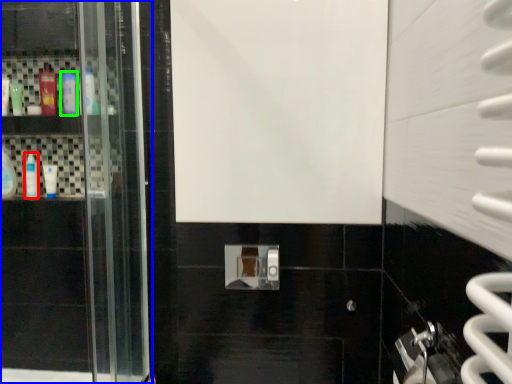
Question: Considering the real-world distances, which object is closest to mouthwash (highlighted by a red box)? door (highlighted by a blue box) or mouthwash (highlighted by a green box).

Choices:
 (A) door
 (B) mouthwash

Answer: (B)